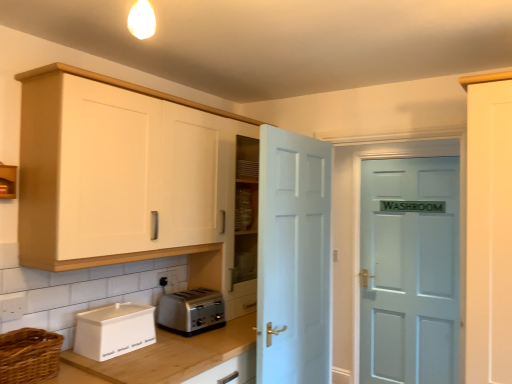
Question: Is white plastic electric outlet at lower center closer to camera compared to satin silver toaster at lower center?

Choices:
 (A) yes
 (B) no

Answer: (B)

Question: Does white plastic electric outlet at lower center have a greater height compared to satin silver toaster at lower center?

Choices:
 (A) no
 (B) yes

Answer: (A)

Question: Is white plastic electric outlet at lower center facing away from satin silver toaster at lower center?

Choices:
 (A) yes
 (B) no

Answer: (B)

Question: Does white plastic electric outlet at lower center have a larger size compared to satin silver toaster at lower center?

Choices:
 (A) no
 (B) yes

Answer: (A)

Question: Considering the relative positions of white plastic electric outlet at lower center and satin silver toaster at lower center in the image provided, is white plastic electric outlet at lower center to the left of satin silver toaster at lower center from the viewer's perspective?

Choices:
 (A) no
 (B) yes

Answer: (B)

Question: Is point (176, 354) positioned closer to the camera than point (223, 304)?

Choices:
 (A) farther
 (B) closer

Answer: (B)

Question: From the image's perspective, is wooden at lower left positioned above or below satin silver toaster at lower center?

Choices:
 (A) below
 (B) above

Answer: (A)

Question: Based on their positions, is wooden at lower left located to the left or right of satin silver toaster at lower center?

Choices:
 (A) left
 (B) right

Answer: (A)

Question: From a real-world perspective, is wooden at lower left physically located above or below satin silver toaster at lower center?

Choices:
 (A) above
 (B) below

Answer: (B)

Question: In terms of size, does woven brown basket at lower left appear bigger or smaller than white plastic electric outlet at lower center?

Choices:
 (A) small
 (B) big

Answer: (B)

Question: From the image's perspective, relative to white plastic electric outlet at lower center, is woven brown basket at lower left above or below?

Choices:
 (A) above
 (B) below

Answer: (B)

Question: Considering the positions of point (44, 352) and point (175, 271), is point (44, 352) closer or farther from the camera than point (175, 271)?

Choices:
 (A) farther
 (B) closer

Answer: (B)

Question: Do you think woven brown basket at lower left is within white plastic electric outlet at lower center, or outside of it?

Choices:
 (A) outside
 (B) inside

Answer: (A)

Question: Would you say matte wood cabinet at upper left, placed as the 1th cabinetry when sorted from left to right, is inside or outside satin silver toaster at lower center?

Choices:
 (A) inside
 (B) outside

Answer: (B)

Question: Does point (6, 168) appear closer or farther from the camera than point (202, 292)?

Choices:
 (A) farther
 (B) closer

Answer: (B)